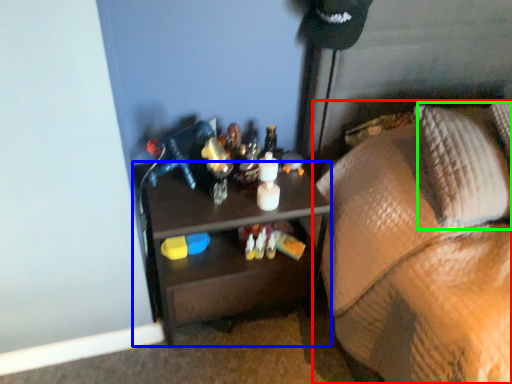
Question: Which object is the closest to the furniture (highlighted by a red box)? Choose among these: desk (highlighted by a blue box) or pillow (highlighted by a green box).

Choices:
 (A) desk
 (B) pillow

Answer: (B)